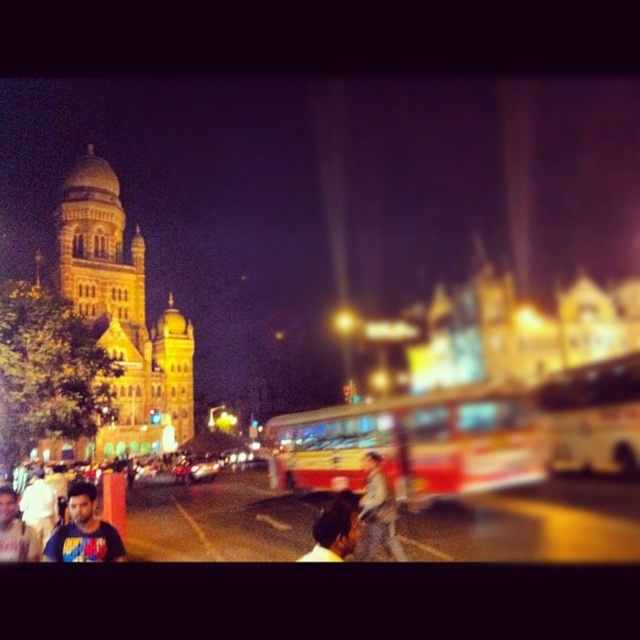
Looking at this image, you are standing at the camera position and want to reach the point marked at coordinates (376, 477). Given that your walking speed is 1.5 meters per second, how many seconds will it take you to reach that point?

The point marked at coordinates (376, 477) is 91.85 meters away from the camera. At a walking speed of 1.5 meters per second, it would take approximately 61.23 seconds to reach that point.

You are a photographer who wants to capture the golden stone tower at upper left and dark brown hair at center in a single frame. Considering their sizes, which object would appear more prominent in the photo?

The golden stone tower at upper left would appear more prominent in the photo because its width is larger than the dark brown hair at center.

You are standing at the camera position observing the scene. There is a point at coordinates point (102, 268). Can you reach that point without moving from your current position?

The point at coordinates point (102, 268) is 101.46 meters away from the camera, so you cannot reach it without moving from your current position.